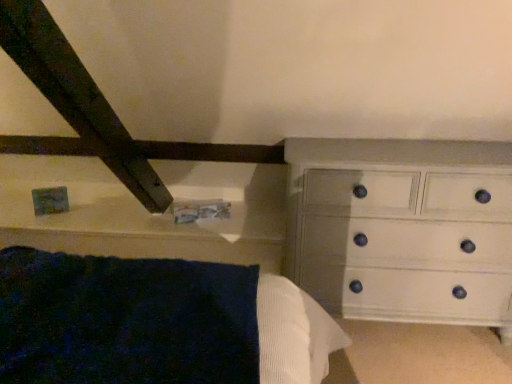
Identify the location of white painted wood chest of drawers at lower right. (403, 229).

Describe the element at coordinates (403, 229) in the screenshot. I see `white painted wood chest of drawers at lower right` at that location.

Identify the location of white painted wood chest of drawers at lower right. The height and width of the screenshot is (384, 512). click(403, 229).